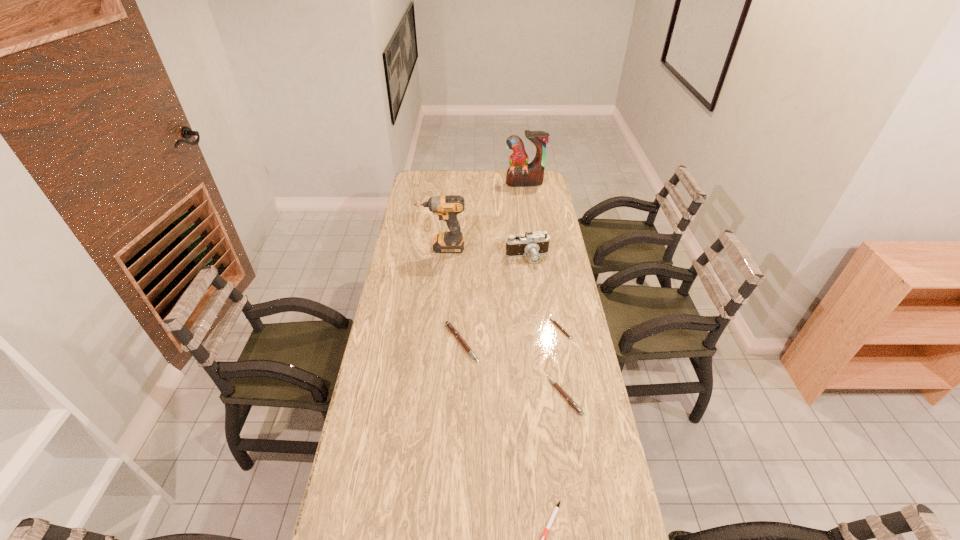
In order to click on parrot that is at the right edge in this screenshot , I will do `click(520, 174)`.

Locate an element on the screen. camera present at the right edge is located at coordinates (533, 244).

Locate an element on the screen. object present at the far right corner is located at coordinates (520, 174).

Find the location of a particular element. This screenshot has width=960, height=540. vacant area at the far edge is located at coordinates (491, 184).

Locate an element on the screen. free space at the left edge of the desktop is located at coordinates (416, 263).

Identify the location of free region at the right edge of the desktop. (529, 212).

Identify the location of blank space at the far left corner of the desktop. The image size is (960, 540). coord(423,179).

Where is `vacant space in between the drill and the second tallest pen`? The width and height of the screenshot is (960, 540). vacant space in between the drill and the second tallest pen is located at coordinates (503, 321).

Find the location of a particular element. vacant area that lies between the second smallest pink pen and the camera is located at coordinates (546, 327).

Identify the location of free point between the second nearest pen and the parrot. The height and width of the screenshot is (540, 960). (544, 289).